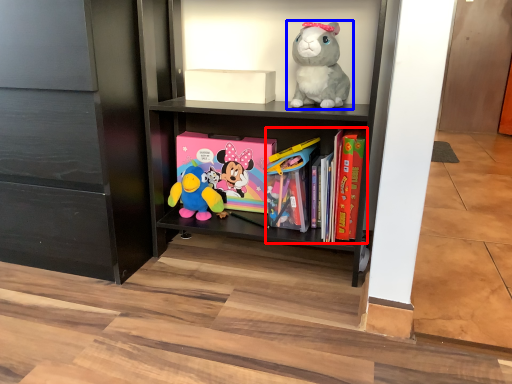
Question: Which of the following is the farthest to the observer, book (highlighted by a red box) or toy (highlighted by a blue box)?

Choices:
 (A) book
 (B) toy

Answer: (A)